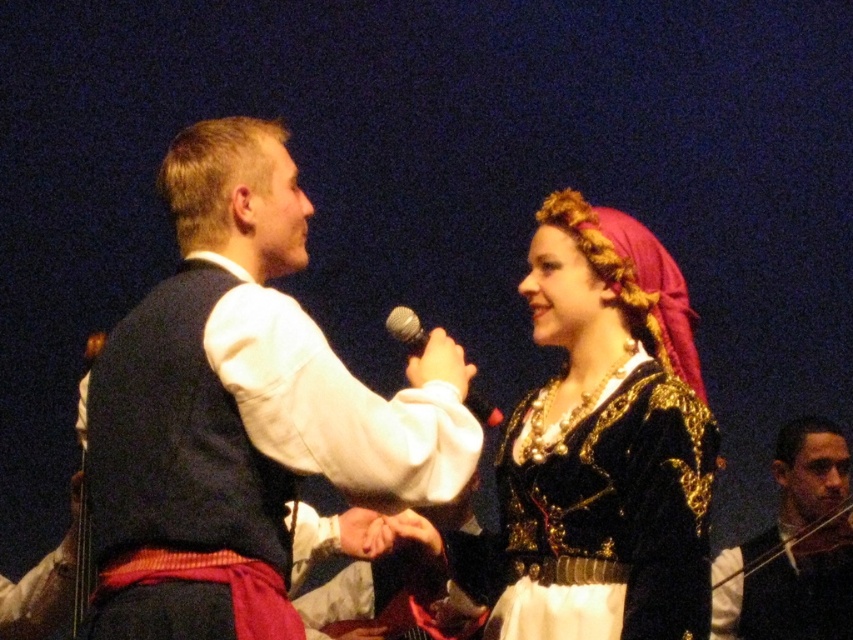
Question: Can you confirm if velvet vest at center is bigger than metallic silver microphone at center?

Choices:
 (A) yes
 (B) no

Answer: (A)

Question: From the image, what is the correct spatial relationship of velvet vest at center in relation to black velvet vest at center?

Choices:
 (A) right
 (B) left

Answer: (B)

Question: Which point is farther to the camera?

Choices:
 (A) velvet black dress at center
 (B) velvet vest at center
 (C) metallic silver microphone at center
 (D) black velvet vest at center

Answer: (D)

Question: Does velvet black dress at center have a smaller size compared to black velvet vest at center?

Choices:
 (A) yes
 (B) no

Answer: (B)

Question: Which point is closer to the camera taking this photo?

Choices:
 (A) (138, 536)
 (B) (828, 525)

Answer: (A)

Question: Which point is farther to the camera?

Choices:
 (A) (674, 417)
 (B) (128, 317)
 (C) (415, 353)
 (D) (802, 493)

Answer: (D)